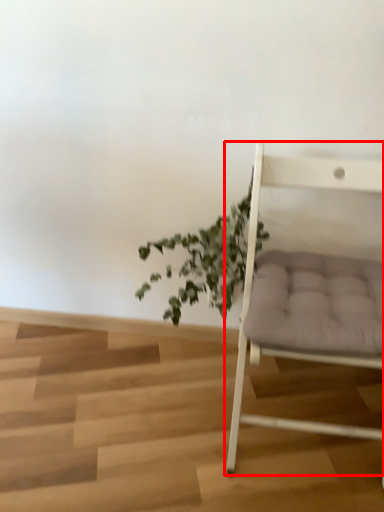
Question: From the image's perspective, considering the relative positions of chair (annotated by the red box) and houseplant in the image provided, where is chair (annotated by the red box) located with respect to the staircase?

Choices:
 (A) below
 (B) above

Answer: (A)